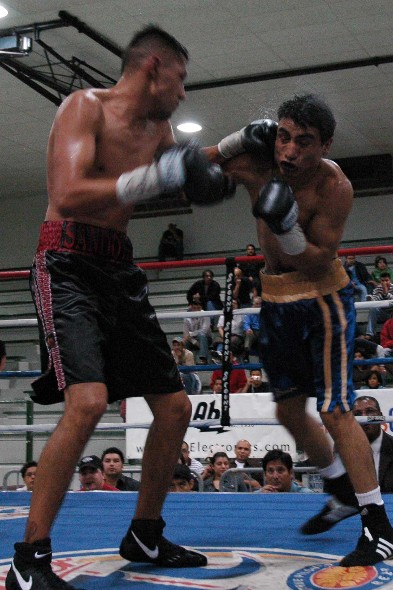
Where is `sock`? The width and height of the screenshot is (393, 590). sock is located at coordinates (330, 471), (363, 494).